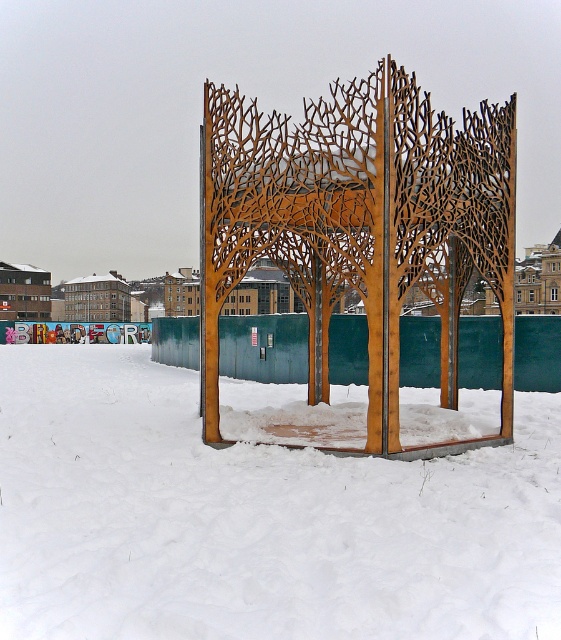
Can you confirm if white powdery snow at lower center is bigger than wooden lattice structure at center?

Incorrect, white powdery snow at lower center is not larger than wooden lattice structure at center.

Is point (15, 413) positioned before point (457, 288)?

No, it is not.

The image size is (561, 640). What do you see at coordinates (255, 518) in the screenshot? I see `white powdery snow at lower center` at bounding box center [255, 518].

Where is `white powdery snow at lower center`? white powdery snow at lower center is located at coordinates (255, 518).